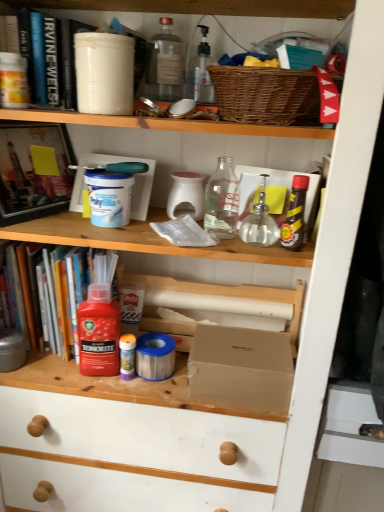
Question: Is red plastic bottle at left, marked as the 3th book in a top-to-bottom arrangement, outside shiny brown bottle at upper right, the 3th bottle viewed from the top?

Choices:
 (A) yes
 (B) no

Answer: (A)

Question: Is red plastic bottle at left, placed as the 1th book when sorted from bottom to top, further to camera compared to shiny brown bottle at upper right, which is the first bottle from right to left?

Choices:
 (A) yes
 (B) no

Answer: (A)

Question: Are red plastic bottle at left, marked as the 3th book in a top-to-bottom arrangement, and shiny brown bottle at upper right, which is the first bottle from right to left, far apart?

Choices:
 (A) yes
 (B) no

Answer: (B)

Question: Does red plastic bottle at left, placed as the 1th book when sorted from bottom to top, have a greater width compared to shiny brown bottle at upper right, the 3th bottle viewed from the top?

Choices:
 (A) yes
 (B) no

Answer: (A)

Question: From a real-world perspective, is red plastic bottle at left, placed as the 1th book when sorted from bottom to top, located beneath shiny brown bottle at upper right, the fifth bottle viewed from the left?

Choices:
 (A) no
 (B) yes

Answer: (B)

Question: Choose the correct answer: Is transparent glass bottle at center, the fourth bottle ordered from the bottom, inside matte cardboard box at center or outside it?

Choices:
 (A) outside
 (B) inside

Answer: (A)

Question: From the image's perspective, is transparent glass bottle at center, which appears as the 2th bottle when viewed from the right, located above or below matte cardboard box at center?

Choices:
 (A) above
 (B) below

Answer: (A)

Question: Would you say transparent glass bottle at center, acting as the 2th bottle starting from the top, is to the left or to the right of matte cardboard box at center in the picture?

Choices:
 (A) right
 (B) left

Answer: (A)

Question: Considering the positions of point (256, 229) and point (269, 362), is point (256, 229) closer or farther from the camera than point (269, 362)?

Choices:
 (A) closer
 (B) farther

Answer: (B)

Question: Is translucent plastic bottle at center, acting as the second bottle starting from the left, taller or shorter than shiny brown bottle at upper right, the fifth bottle viewed from the left?

Choices:
 (A) tall
 (B) short

Answer: (B)

Question: Which is correct: translucent plastic bottle at center, acting as the second bottle starting from the left, is inside shiny brown bottle at upper right, which is the first bottle from right to left, or outside of it?

Choices:
 (A) outside
 (B) inside

Answer: (A)

Question: Considering the positions of point (125, 365) and point (302, 218), is point (125, 365) closer or farther from the camera than point (302, 218)?

Choices:
 (A) closer
 (B) farther

Answer: (B)

Question: From a real-world perspective, is translucent plastic bottle at center, which appears as the 1th bottle when ordered from the bottom, positioned above or below shiny brown bottle at upper right, the fifth bottle viewed from the left?

Choices:
 (A) below
 (B) above

Answer: (A)

Question: From the image's perspective, is woven brown basket at upper center positioned above or below matte cardboard box at center?

Choices:
 (A) above
 (B) below

Answer: (A)

Question: Considering their positions, is woven brown basket at upper center located in front of or behind matte cardboard box at center?

Choices:
 (A) behind
 (B) front

Answer: (B)